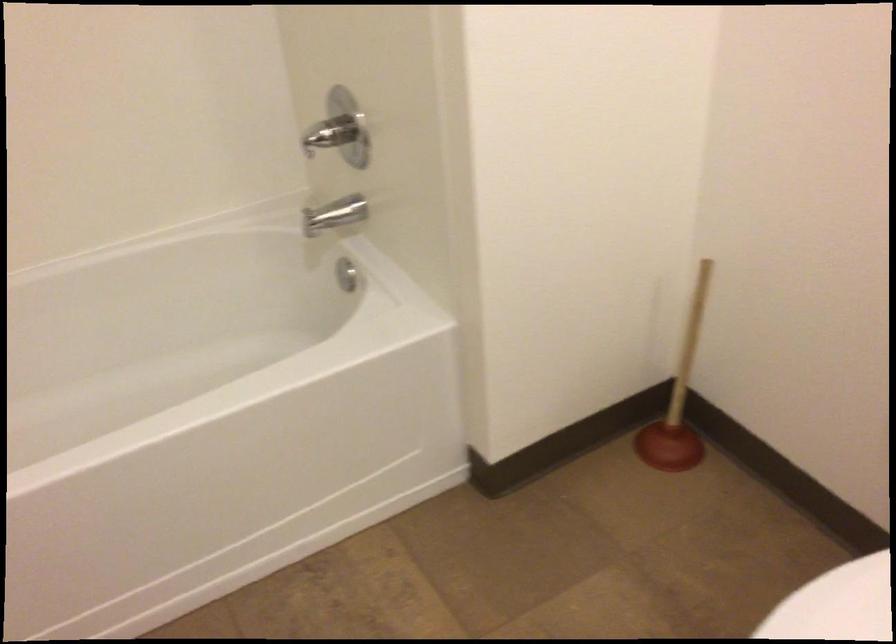
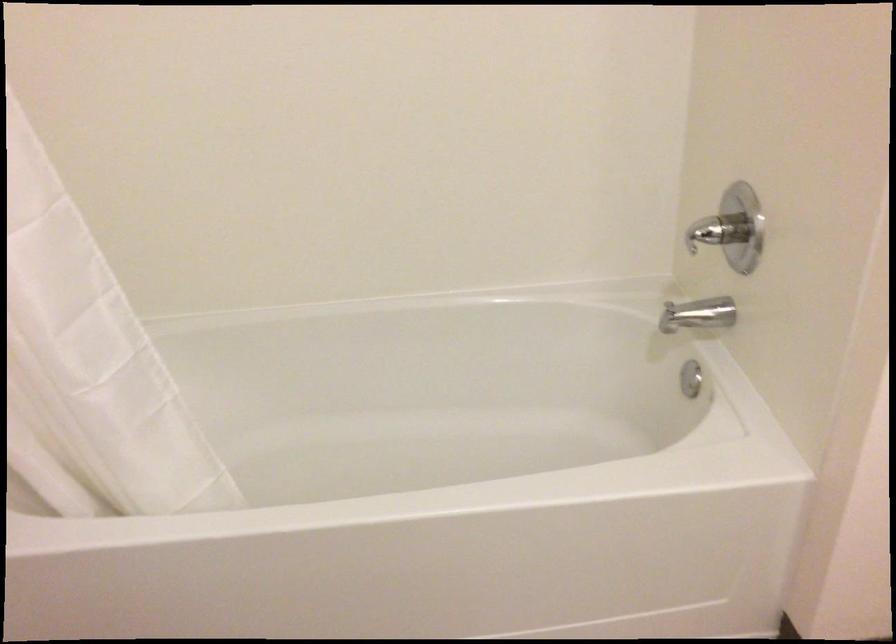
Question: The images are taken continuously from a first-person perspective. In which direction is your viewpoint rotating?

Choices:
 (A) Left
 (B) Right
 (C) Up
 (D) Down

Answer: (A)